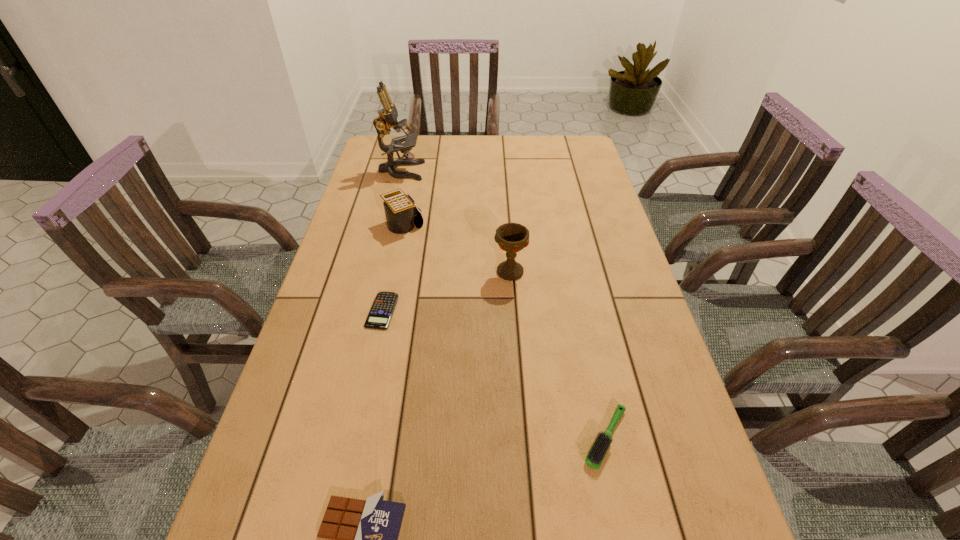
Identify which object is the nearest to the shortest object. Please provide its 2D coordinates. Your answer should be formatted as a tuple, i.e. [(x, y)], where the tuple contains the x and y coordinates of a point satisfying the conditions above.

[(402, 217)]

Find the location of a particular element. The width and height of the screenshot is (960, 540). free point that satisfies the following two spatial constraints: 1. at the eyepieces of the microscope; 2. on the left side of the chalice is located at coordinates (376, 272).

I want to click on vacant area in the image that satisfies the following two spatial constraints: 1. at the eyepieces of the farthest object; 2. on the back side of the second farthest object, so click(388, 225).

Locate an element on the screen. free location that satisfies the following two spatial constraints: 1. at the eyepieces of the farthest object; 2. on the left side of the nearer calculator is located at coordinates (367, 310).

In order to click on free location that satisfies the following two spatial constraints: 1. at the eyepieces of the farthest object; 2. on the back side of the second nearest object in this screenshot , I will do `click(335, 438)`.

The height and width of the screenshot is (540, 960). Identify the location of vacant point that satisfies the following two spatial constraints: 1. on the back side of the shortest object; 2. on the left side of the fifth nearest object. (400, 225).

The height and width of the screenshot is (540, 960). I want to click on vacant region that satisfies the following two spatial constraints: 1. on the back side of the nearer calculator; 2. at the eyepieces of the microscope, so [x=412, y=171].